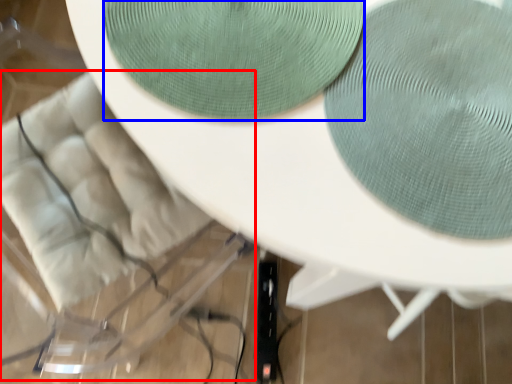
Question: Which of the following is the closest to the observer, swivel chair (highlighted by a red box) or oval (highlighted by a blue box)?

Choices:
 (A) swivel chair
 (B) oval

Answer: (B)